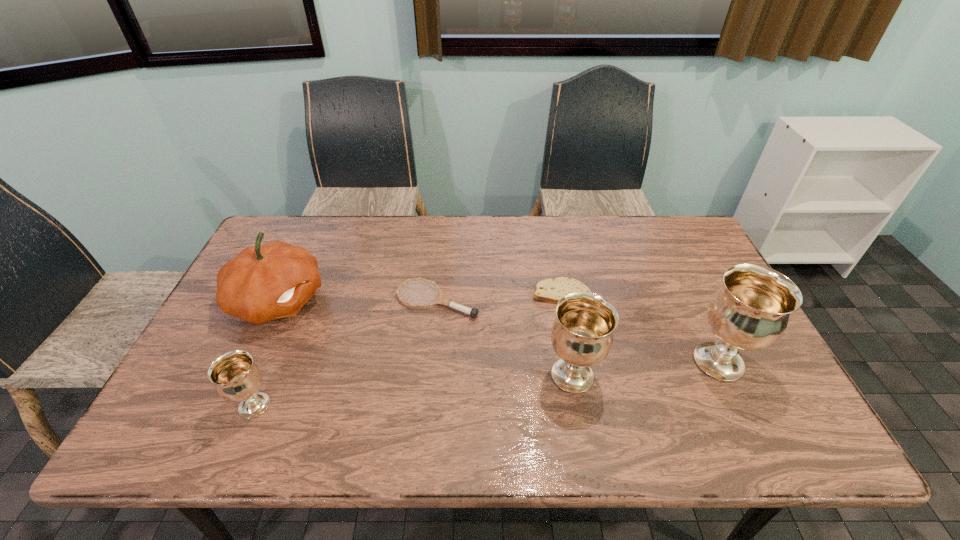
The height and width of the screenshot is (540, 960). I want to click on free space at the right edge of the desktop, so (689, 269).

Locate an element on the screen. blank space at the far right corner of the desktop is located at coordinates (646, 231).

Where is `vacant area that lies between the pita bread and the tennis racket`? The image size is (960, 540). vacant area that lies between the pita bread and the tennis racket is located at coordinates coord(499,296).

Locate an element on the screen. The height and width of the screenshot is (540, 960). free space that is in between the pumpkin and the second chalice from right to left is located at coordinates (425, 338).

Where is `free space between the second tallest chalice and the rightmost object`? The height and width of the screenshot is (540, 960). free space between the second tallest chalice and the rightmost object is located at coordinates (645, 369).

This screenshot has height=540, width=960. I want to click on free space between the fourth object from right to left and the pumpkin, so click(x=358, y=300).

Where is `vacant space that is in between the pita bread and the rightmost object`? vacant space that is in between the pita bread and the rightmost object is located at coordinates (639, 327).

You are a GUI agent. You are given a task and a screenshot of the screen. Output one action in this format:
    pyautogui.click(x=<x>, y=<y>)
    Task: Click on the vacant area that lies between the second shortest chalice and the tennis racket
    The height and width of the screenshot is (540, 960).
    Given the screenshot: What is the action you would take?
    pyautogui.click(x=505, y=338)

In order to click on vacant space that is in between the second tallest chalice and the rightmost chalice in this screenshot , I will do `click(645, 369)`.

Locate an element on the screen. free space between the fourth tallest object and the pita bread is located at coordinates (408, 349).